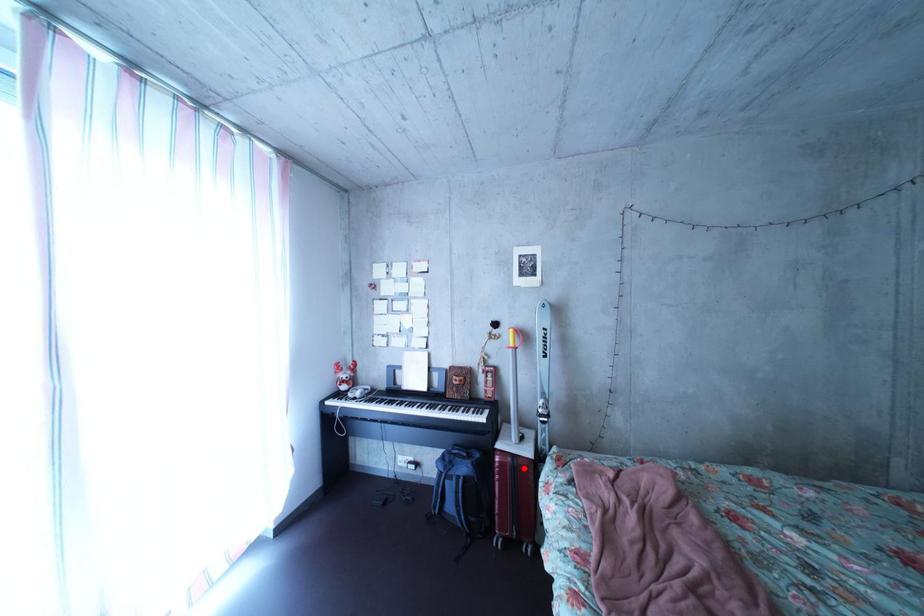
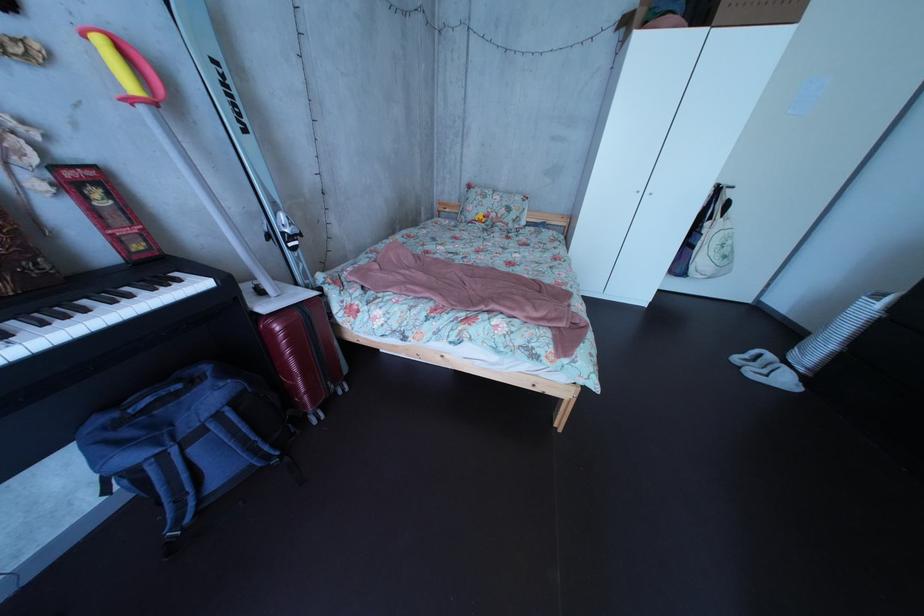
The point at the highlighted location is marked in the first image. Where is the corresponding point in the second image?

(311, 322)